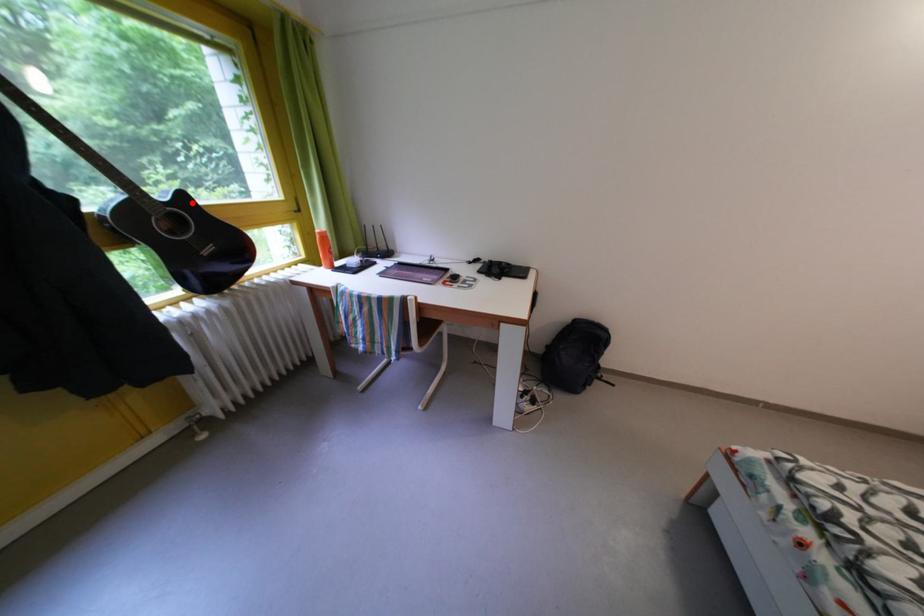
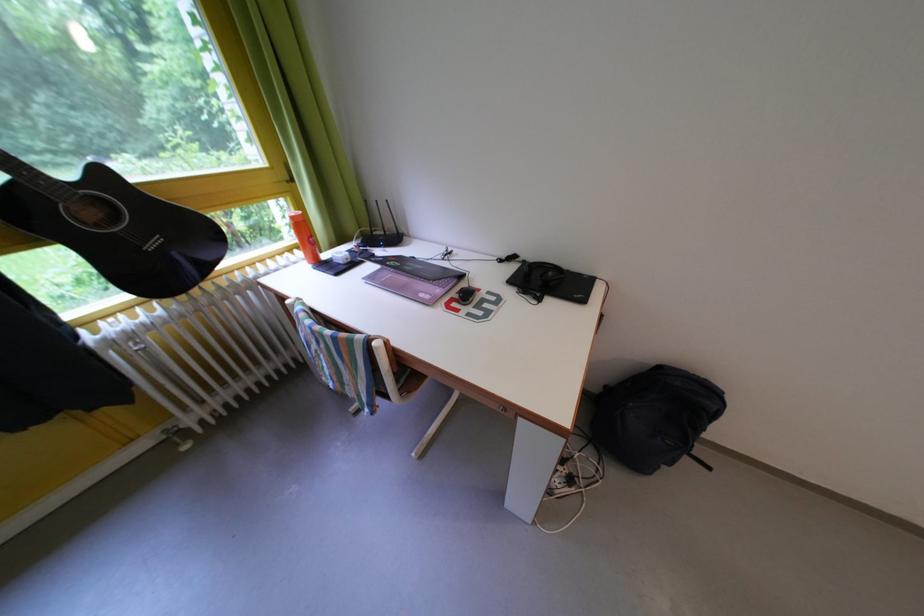
Find the pixel in the second image that matches the highlighted location in the first image.

(112, 179)